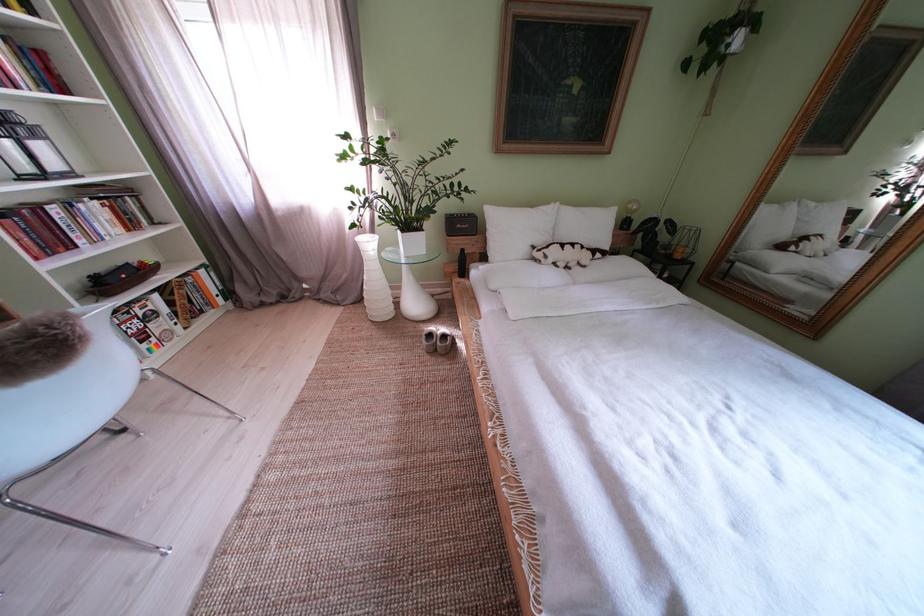
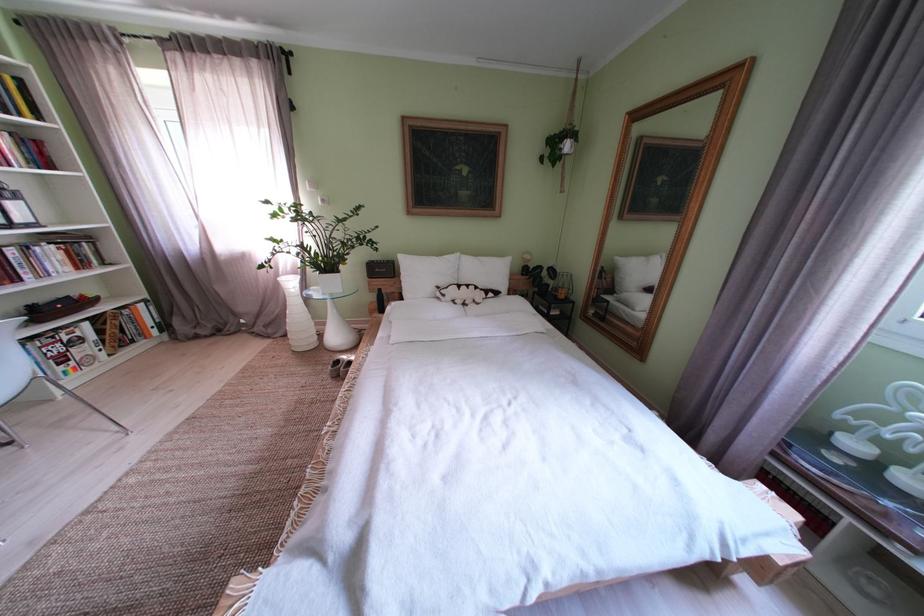
In the second image, find the point that corresponds to point (166, 318) in the first image.

(92, 344)